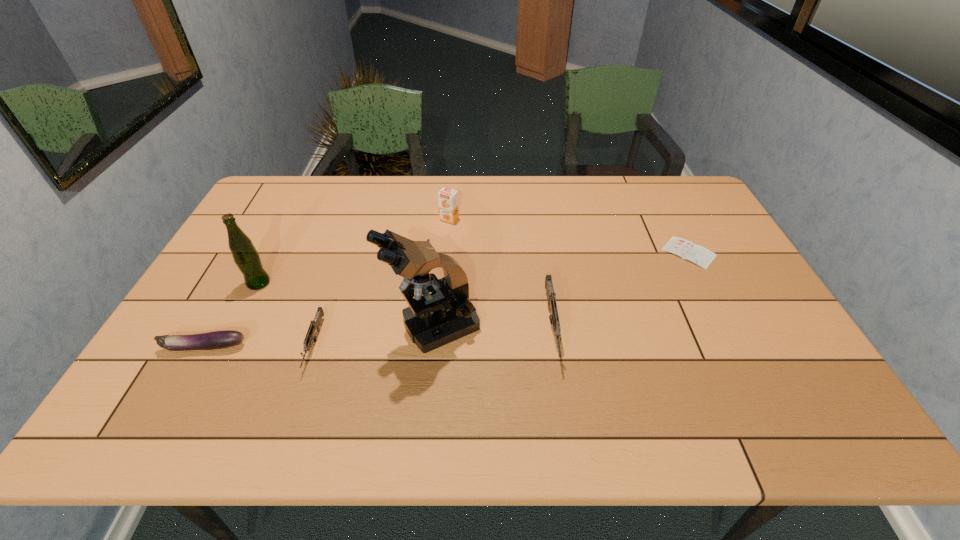
Find the location of `eggplant`. eggplant is located at coordinates tap(222, 339).

Find the location of `vacant space situated 0.370m on the right of the third tallest object`. vacant space situated 0.370m on the right of the third tallest object is located at coordinates (570, 219).

Where is `vacant space located 0.340m on the right of the beer bottle`? This screenshot has width=960, height=540. vacant space located 0.340m on the right of the beer bottle is located at coordinates (391, 283).

The image size is (960, 540). Find the location of `vacant area situated on the front of the shortest object`. vacant area situated on the front of the shortest object is located at coordinates (714, 302).

Find the location of a particular element. Image resolution: width=960 pixels, height=540 pixels. vacant position located 0.360m on the back of the microscope is located at coordinates (444, 218).

At what (x,y) coordinates should I click in order to perform the action: click on vacant space located 0.190m on the right of the second shortest object. Please return your answer as a coordinate pair (x, y). Looking at the image, I should click on (323, 347).

You are a GUI agent. You are given a task and a screenshot of the screen. Output one action in this format:
    pyautogui.click(x=<x>, y=<y>)
    Task: Click on the beer bottle located at the left edge
    
    Given the screenshot: What is the action you would take?
    pyautogui.click(x=246, y=257)

What are the coordinates of `eggplant located at the left edge` in the screenshot? It's located at (222, 339).

This screenshot has width=960, height=540. I want to click on object situated at the right edge, so click(x=686, y=249).

Where is `vacant space at the far edge of the desktop`? vacant space at the far edge of the desktop is located at coordinates (372, 190).